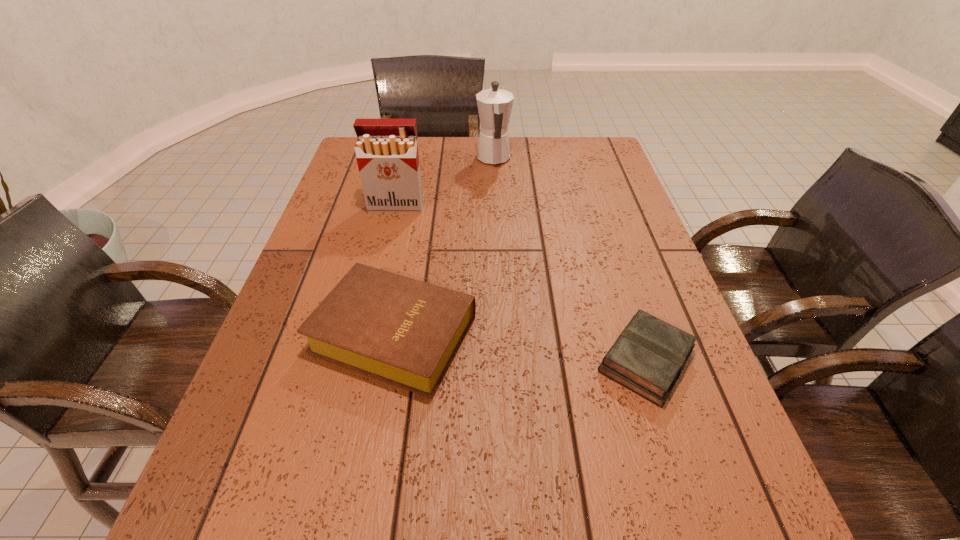
Where is `blank area in the image that satisfies the following two spatial constraints: 1. with the lid open on the rightmost object; 2. on the right side of the cigarette case`? This screenshot has width=960, height=540. blank area in the image that satisfies the following two spatial constraints: 1. with the lid open on the rightmost object; 2. on the right side of the cigarette case is located at coordinates (360, 360).